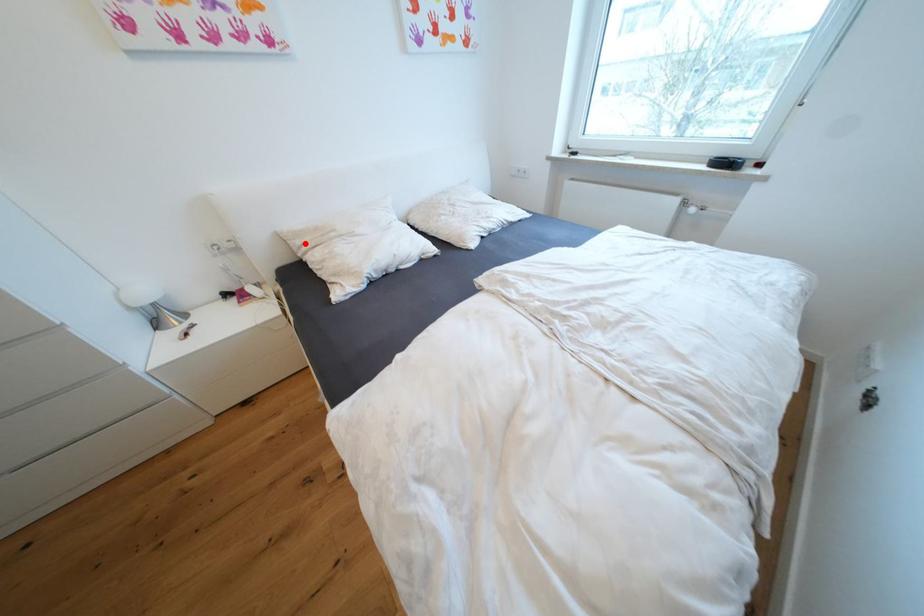
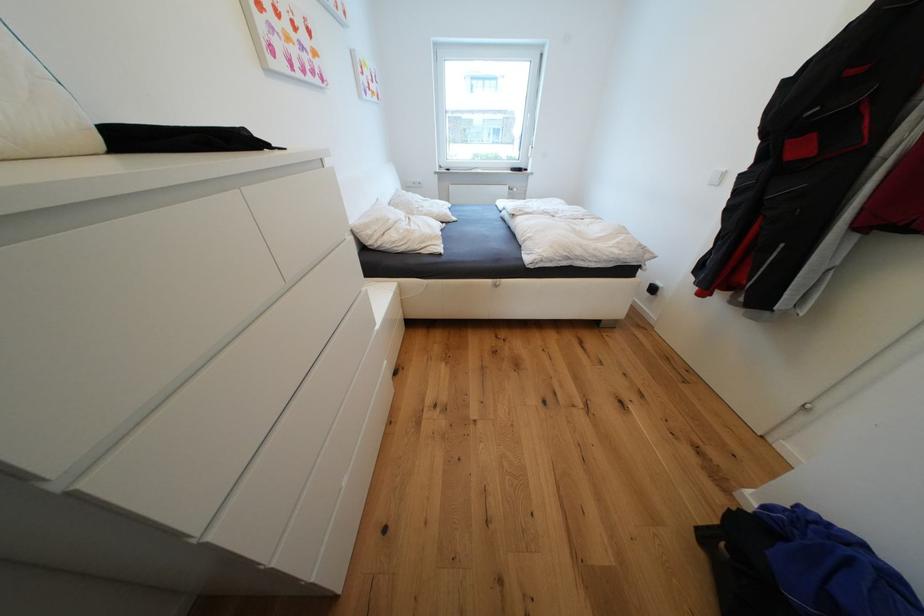
Locate, in the second image, the point that corresponds to the highlighted location in the first image.

(377, 233)